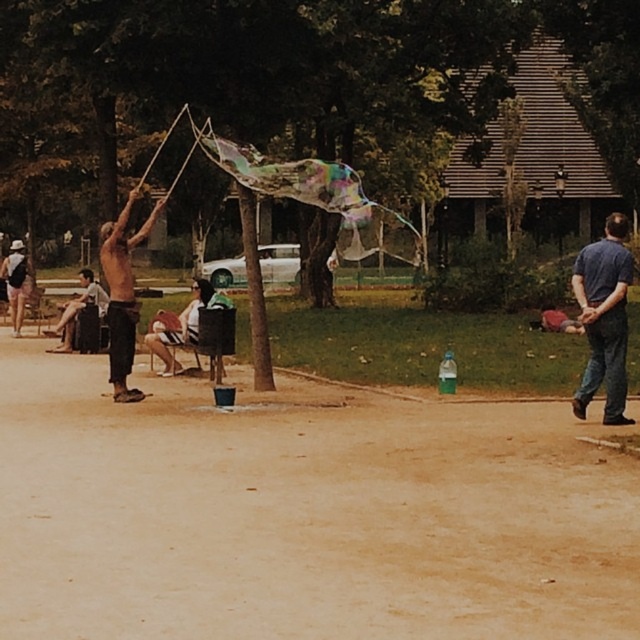
Question: Is blue denim jeans at right wider than light brown fabric chair at center?

Choices:
 (A) no
 (B) yes

Answer: (A)

Question: Which point is closer to the camera?

Choices:
 (A) (628, 273)
 (B) (172, 358)

Answer: (A)

Question: Which of the following is the farthest from the observer?

Choices:
 (A) (104, 252)
 (B) (195, 316)
 (C) (275, 484)
 (D) (600, 252)

Answer: (B)

Question: Can you confirm if blue denim jeans at right is positioned to the left of light brown fabric chair at center?

Choices:
 (A) yes
 (B) no

Answer: (B)

Question: Is blue denim jeans at right above shiny black pants at left?

Choices:
 (A) no
 (B) yes

Answer: (A)

Question: Which point is closer to the camera?

Choices:
 (A) (579, 316)
 (B) (154, 317)

Answer: (B)